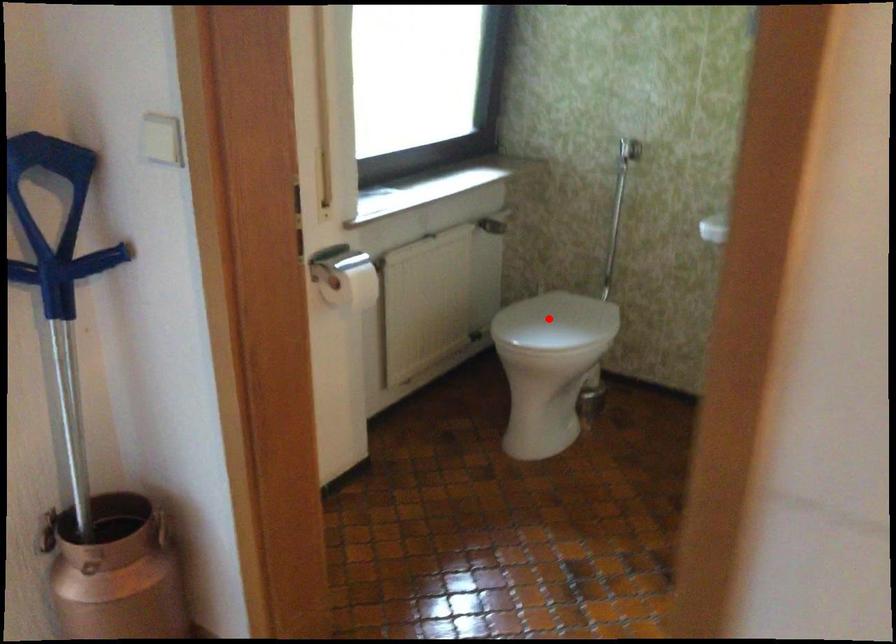
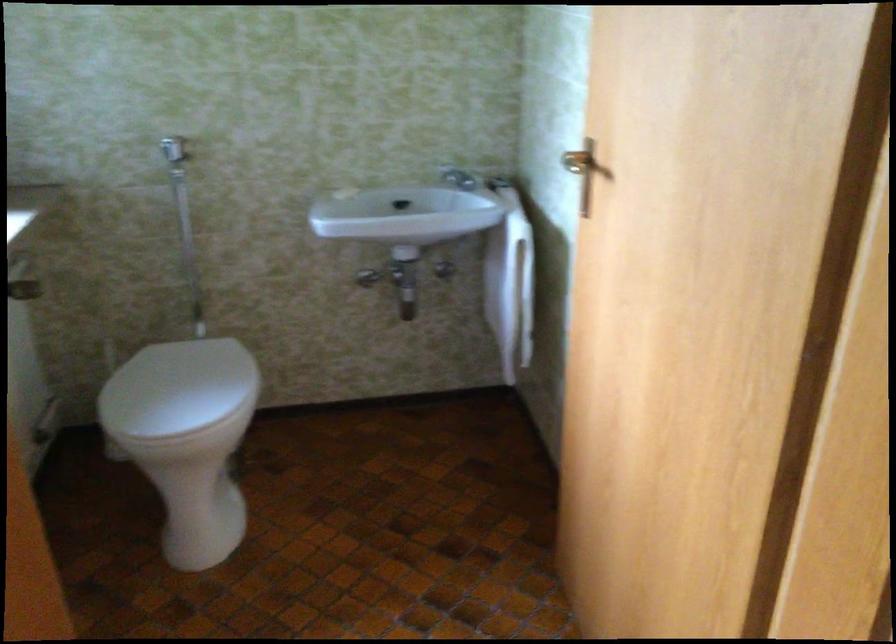
Find the pixel in the second image that matches the highlighted location in the first image.

(177, 388)